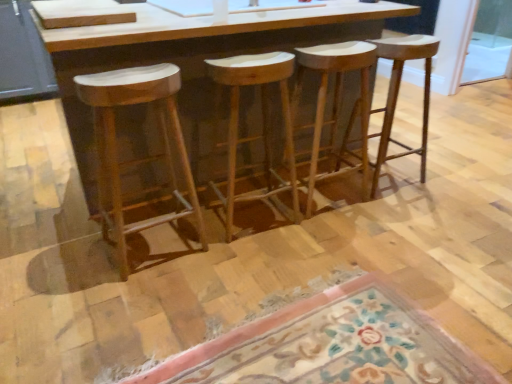
Question: Is natural wood stool at center, which appears as the second stool when viewed from the left, spatially inside floral carpet at lower center, or outside of it?

Choices:
 (A) outside
 (B) inside

Answer: (A)

Question: Considering the relative positions of natural wood stool at center, which appears as the second stool when viewed from the left, and floral carpet at lower center in the image provided, is natural wood stool at center, which appears as the second stool when viewed from the left, to the left or to the right of floral carpet at lower center?

Choices:
 (A) right
 (B) left

Answer: (B)

Question: Estimate the real-world distances between objects in this image. Which object is closer to the natural wood stool at center, which appears as the second stool when viewed from the left?

Choices:
 (A) floral carpet at lower center
 (B) natural wood stool at left, arranged as the first stool when viewed from the left
 (C) transparent glass screen door at upper right
 (D) wooden barstools at center
 (E) natural wood stool at center, the fourth stool viewed from the left

Answer: (D)

Question: Estimate the real-world distances between objects in this image. Which object is closer to the wooden barstools at center?

Choices:
 (A) natural wood stool at center, the 2th stool in the right-to-left sequence
 (B) floral carpet at lower center
 (C) natural wood stool at center, the fourth stool viewed from the left
 (D) natural wood stool at center, which appears as the second stool when viewed from the left
 (E) natural wood stool at left, which is counted as the fourth stool, starting from the right

Answer: (E)